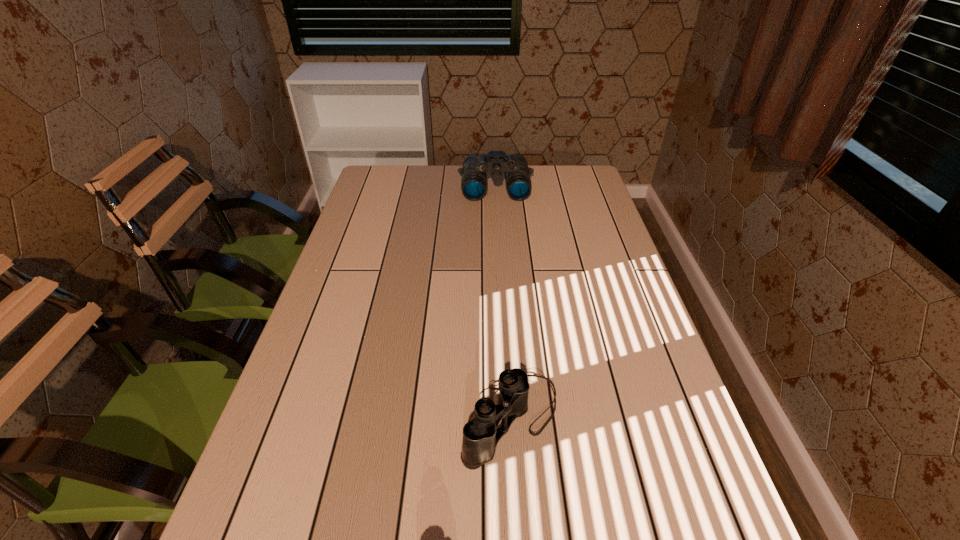
Where is `the farther binoculars`? The width and height of the screenshot is (960, 540). the farther binoculars is located at coordinates (475, 166).

Image resolution: width=960 pixels, height=540 pixels. I want to click on the nearer binoculars, so click(x=480, y=435).

At what (x,y) coordinates should I click in order to perform the action: click on free space located through the lenses of the farther object. Please return your answer as a coordinate pair (x, y). The height and width of the screenshot is (540, 960). Looking at the image, I should click on (499, 264).

The image size is (960, 540). I want to click on vacant space situated 0.160m on the right of the nearer object, so click(x=638, y=416).

This screenshot has height=540, width=960. Identify the location of object positioned at the far edge. (475, 166).

The image size is (960, 540). In the image, there is a desktop. Identify the location of free space at the left edge. (377, 284).

Where is `vacant space at the right edge`? vacant space at the right edge is located at coordinates (652, 401).

The width and height of the screenshot is (960, 540). In the image, there is a desktop. Identify the location of vacant space at the far left corner. (370, 174).

What are the coordinates of `vacant space at the far right corner of the desktop` in the screenshot? It's located at (566, 194).

The image size is (960, 540). I want to click on free space that is in between the nearer binoculars and the farther binoculars, so click(x=503, y=301).